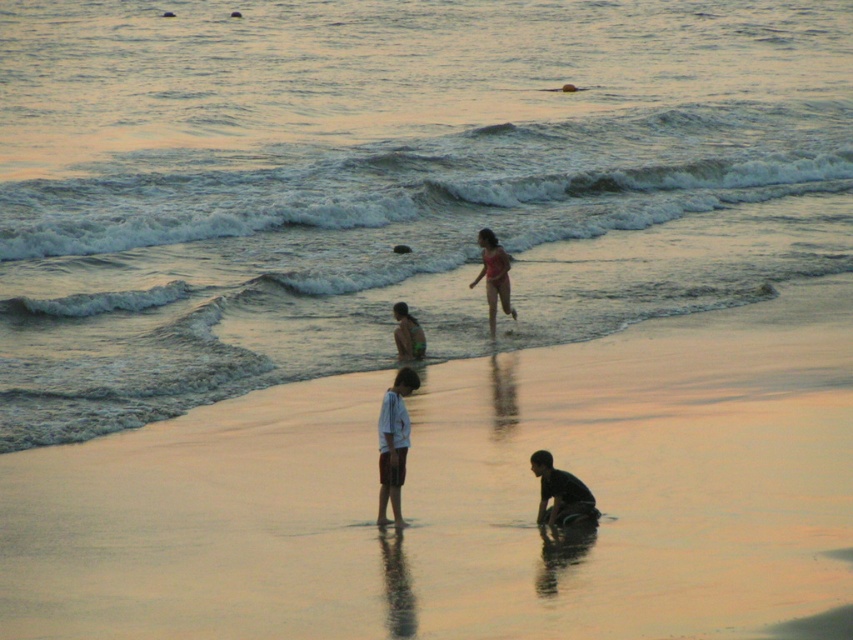
Question: Does shiny silver water at center appear over smooth skin person at center?

Choices:
 (A) yes
 (B) no

Answer: (A)

Question: Which of the following is the closest to the observer?

Choices:
 (A) smooth skin person at center
 (B) shiny silver water at center
 (C) smooth sand at center

Answer: (C)

Question: Which of the following is the farthest from the observer?

Choices:
 (A) (405, 200)
 (B) (83, 536)
 (C) (408, 316)

Answer: (A)

Question: Where is shiny silver water at center located in relation to smooth skin person at center in the image?

Choices:
 (A) below
 (B) above

Answer: (B)

Question: Based on their relative distances, which object is farther from the pink fabric swimsuit at center?

Choices:
 (A) smooth sand at center
 (B) shiny silver water at center
 (C) dark skin/texture person at lower center

Answer: (B)

Question: Does white cotton shirt at center lie behind dark skin/texture person at lower center?

Choices:
 (A) no
 (B) yes

Answer: (A)